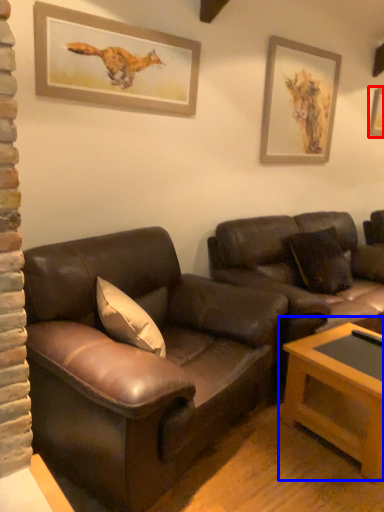
Question: Which point is closer to the camera, picture frame (highlighted by a red box) or table (highlighted by a blue box)?

Choices:
 (A) picture frame
 (B) table

Answer: (B)